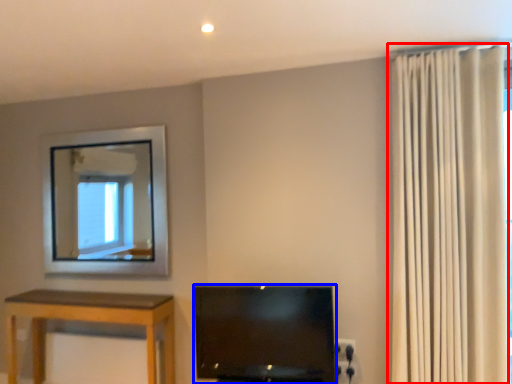
Question: Which of the following is the closest to the observer, curtain (highlighted by a red box) or television (highlighted by a blue box)?

Choices:
 (A) curtain
 (B) television

Answer: (A)